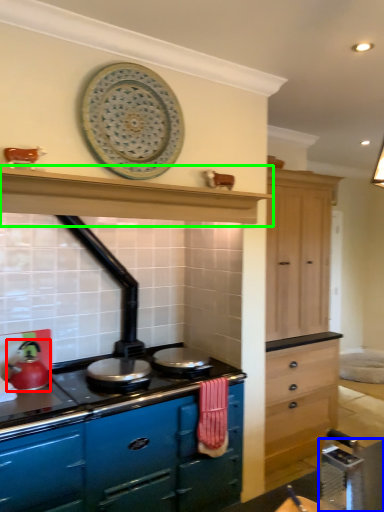
Question: Which object is positioned closest to kitchen appliance (highlighted by a red box)? Select from table (highlighted by a blue box) and exhaust hood (highlighted by a green box).

Choices:
 (A) table
 (B) exhaust hood

Answer: (B)